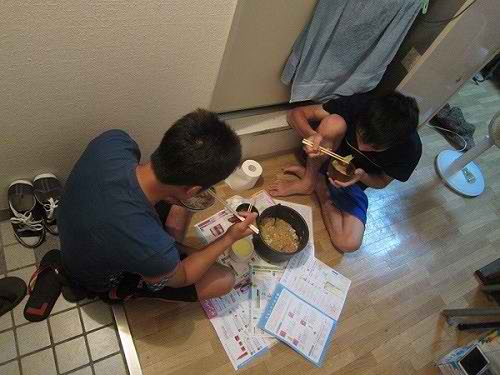
Find the location of a particular element. This screenshot has height=375, width=500. blue towel is located at coordinates (361, 53).